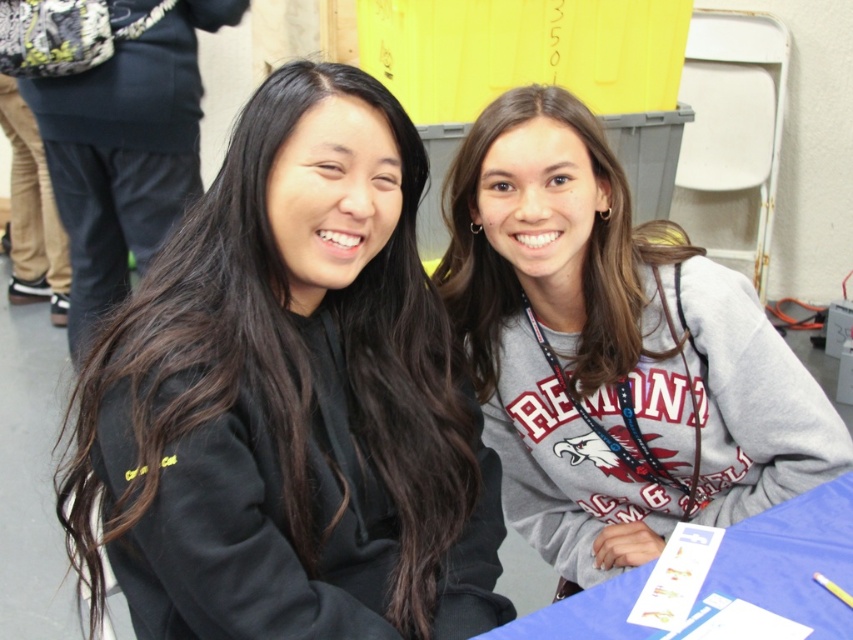
Question: Is gray fleece sweatshirt at center bigger than blue fabric table at lower right?

Choices:
 (A) yes
 (B) no

Answer: (A)

Question: Which point is farther to the camera?

Choices:
 (A) black matte hair at upper left
 (B) black matte sweatshirt at center
 (C) gray fleece sweatshirt at center
 (D) blue fabric table at lower right

Answer: (A)

Question: Which of these objects is positioned farthest from the black matte sweatshirt at center?

Choices:
 (A) black matte hair at upper left
 (B) gray sweatshirt at center
 (C) blue fabric table at lower right

Answer: (A)

Question: From the image, what is the correct spatial relationship of gray sweatshirt at center in relation to blue fabric table at lower right?

Choices:
 (A) right
 (B) left

Answer: (B)

Question: Which point is farther to the camera?

Choices:
 (A) black matte hair at upper left
 (B) gray fleece sweatshirt at center

Answer: (A)

Question: From the image, what is the correct spatial relationship of black matte sweatshirt at center in relation to gray fleece sweatshirt at center?

Choices:
 (A) right
 (B) left

Answer: (B)